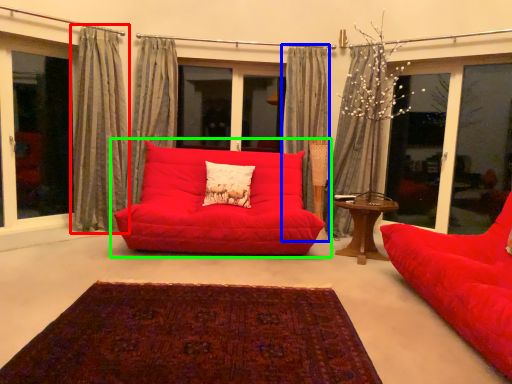
Question: Which is nearer to the curtain (highlighted by a red box)? curtain (highlighted by a blue box) or studio couch (highlighted by a green box).

Choices:
 (A) curtain
 (B) studio couch

Answer: (B)